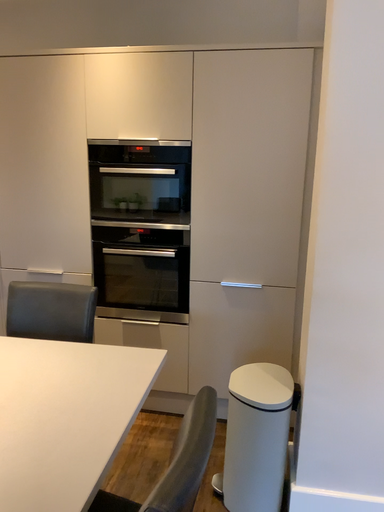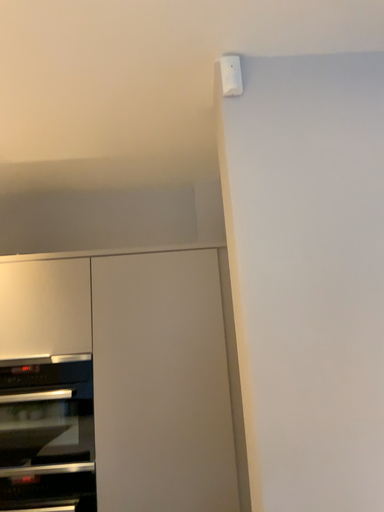
Question: Which way did the camera rotate in the video?

Choices:
 (A) rotated right
 (B) rotated left

Answer: (A)